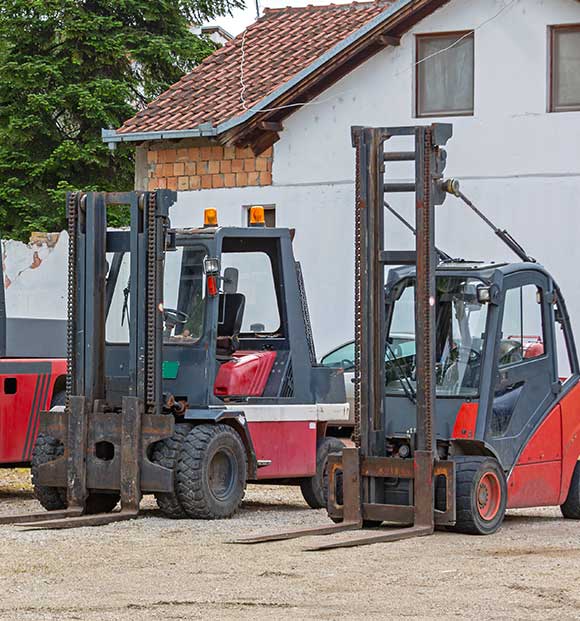
This screenshot has width=580, height=621. I want to click on the left forks, so click(290, 532), click(42, 514).